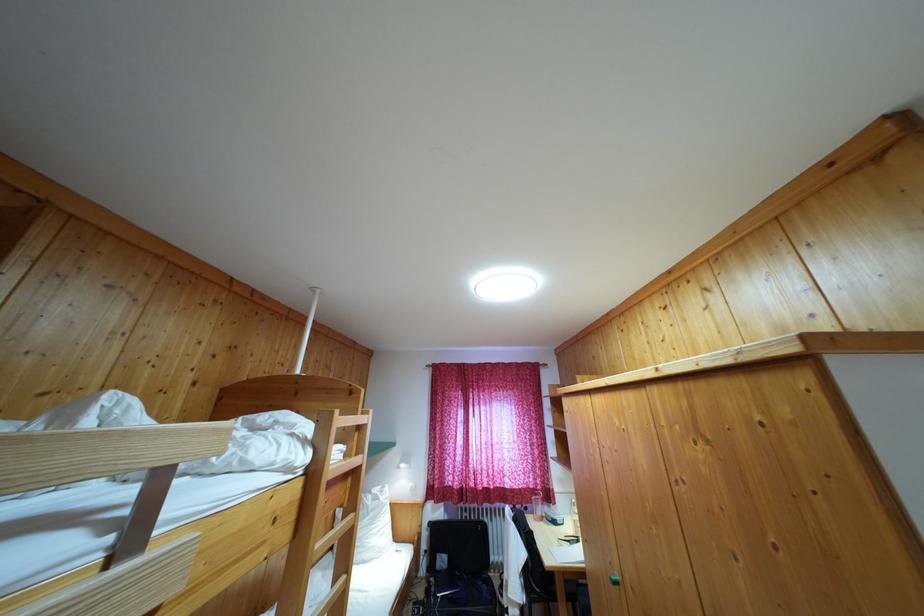
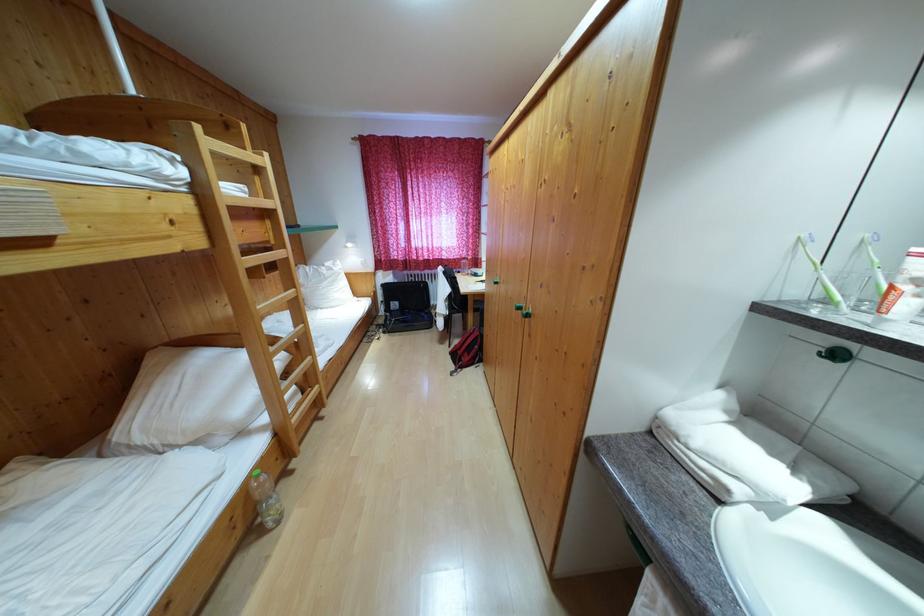
Question: The first image is from the beginning of the video and the second image is from the end. How did the camera likely rotate when shooting the video?

Choices:
 (A) Left
 (B) Right
 (C) Up
 (D) Down

Answer: (D)